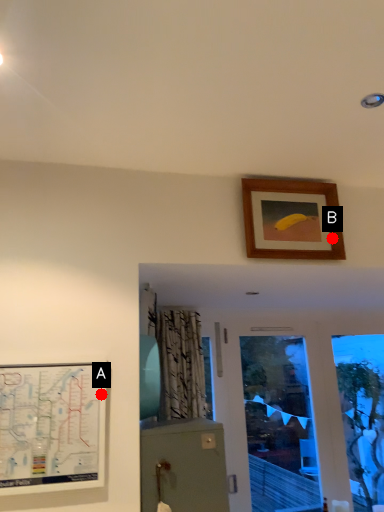
Question: Two points are circled on the image, labeled by A and B beside each circle. Which of the following is the farthest from the observer?

Choices:
 (A) A is further
 (B) B is further

Answer: (B)